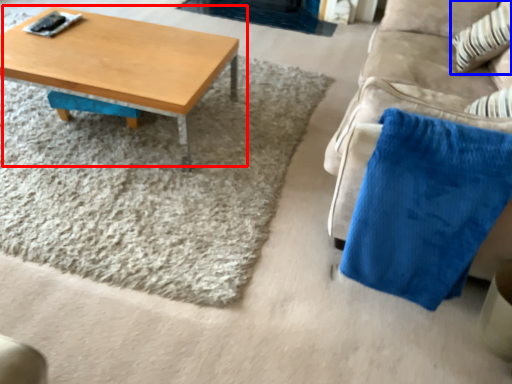
Question: Which object is closer to the camera taking this photo, coffee table (highlighted by a red box) or throw pillow (highlighted by a blue box)?

Choices:
 (A) coffee table
 (B) throw pillow

Answer: (A)